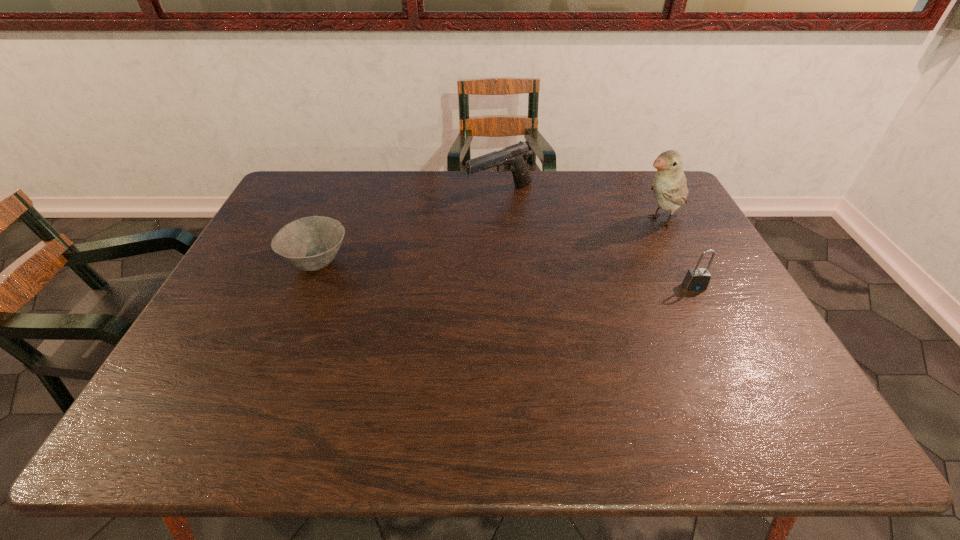
At what (x,y) coordinates should I click in order to perform the action: click on vacant space on the desktop that is between the leftmost object and the third tallest object and is positioned at the face of the tallest object. Please return your answer as a coordinate pair (x, y). The width and height of the screenshot is (960, 540). Looking at the image, I should click on (539, 276).

At what (x,y) coordinates should I click in order to perform the action: click on free space on the desktop that is between the shortest object and the third tallest object and is positioned at the muzzle of the gun. Please return your answer as a coordinate pair (x, y). The image size is (960, 540). Looking at the image, I should click on (457, 271).